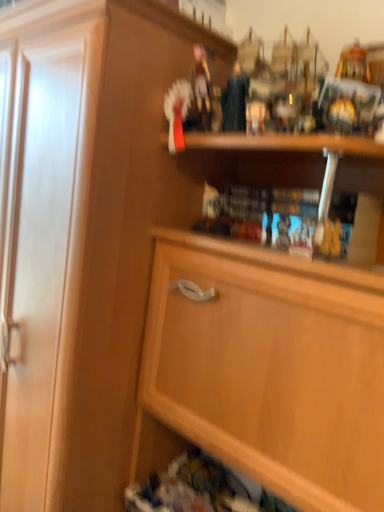
What do you see at coordinates (262, 216) in the screenshot? I see `hardcover book at center` at bounding box center [262, 216].

Locate an element on the screen. hardcover book at center is located at coordinates (262, 216).

Find the location of a particular element. wooden cabinet at upper center is located at coordinates (268, 367).

The image size is (384, 512). What do you see at coordinates (268, 367) in the screenshot? I see `wooden cabinet at upper center` at bounding box center [268, 367].

Identify the location of hardcover book at center. The height and width of the screenshot is (512, 384). (262, 216).

Can you confirm if hardcover book at center is positioned to the left of wooden cabinet at upper center?

Incorrect, hardcover book at center is not on the left side of wooden cabinet at upper center.

Is the depth of hardcover book at center less than that of wooden cabinet at upper center?

No, it is not.

Does point (275, 189) appear closer or farther from the camera than point (371, 499)?

Point (275, 189) is farther from the camera than point (371, 499).

From the image's perspective, is hardcover book at center located above wooden cabinet at upper center?

Yes, from the image's perspective, hardcover book at center is on top of wooden cabinet at upper center.

From a real-world perspective, which is physically above, hardcover book at center or wooden cabinet at upper center?

hardcover book at center.

Which object is thinner, hardcover book at center or wooden cabinet at upper center?

Thinner between the two is hardcover book at center.

Is hardcover book at center taller or shorter than wooden cabinet at upper center?

Clearly, hardcover book at center is shorter compared to wooden cabinet at upper center.

Does hardcover book at center have a smaller size compared to wooden cabinet at upper center?

Yes.

From the picture: Could wooden cabinet at upper center be considered to be inside hardcover book at center?

No, wooden cabinet at upper center is not a part of hardcover book at center.

Is hardcover book at center in contact with wooden cabinet at upper center?

No, hardcover book at center is not next to wooden cabinet at upper center.

Is hardcover book at center oriented away from wooden cabinet at upper center?

Yes, hardcover book at center is positioned with its back facing wooden cabinet at upper center.

Measure the distance between hardcover book at center and wooden cabinet at upper center.

hardcover book at center and wooden cabinet at upper center are 8.58 inches apart from each other.

Find the location of a particular element. The width and height of the screenshot is (384, 512). cabinetry below the hardcover book at center (from the image's perspective) is located at coordinates (268, 367).

Considering the positions of objects wooden cabinet at upper center and hardcover book at center in the image provided, who is more to the left, wooden cabinet at upper center or hardcover book at center?

From the viewer's perspective, wooden cabinet at upper center appears more on the left side.

Is wooden cabinet at upper center closer to camera compared to hardcover book at center?

That is True.

Which is in front, point (197, 254) or point (330, 234)?

The point (330, 234) is in front.

From the image's perspective, is wooden cabinet at upper center below hardcover book at center?

Yes.

From a real-world perspective, which is physically above, wooden cabinet at upper center or hardcover book at center?

From a 3D spatial view, hardcover book at center is above.

Can you confirm if wooden cabinet at upper center is thinner than hardcover book at center?

In fact, wooden cabinet at upper center might be wider than hardcover book at center.

Considering the relative sizes of wooden cabinet at upper center and hardcover book at center in the image provided, is wooden cabinet at upper center taller than hardcover book at center?

Indeed, wooden cabinet at upper center has a greater height compared to hardcover book at center.

Which of these two, wooden cabinet at upper center or hardcover book at center, is smaller?

With smaller size is hardcover book at center.

Is wooden cabinet at upper center not within hardcover book at center?

Yes, wooden cabinet at upper center is located beyond the bounds of hardcover book at center.

Consider the image. Is wooden cabinet at upper center placed right next to hardcover book at center?

No, wooden cabinet at upper center is not beside hardcover book at center.

Is wooden cabinet at upper center positioned with its back to hardcover book at center?

Correct, wooden cabinet at upper center is looking away from hardcover book at center.

How different are the orientations of wooden cabinet at upper center and hardcover book at center in degrees?

The angular difference between wooden cabinet at upper center and hardcover book at center is 1.24 degrees.

How much distance is there between wooden cabinet at upper center and hardcover book at center?

wooden cabinet at upper center is 8.58 inches away from hardcover book at center.

This screenshot has height=512, width=384. In order to click on book above the wooden cabinet at upper center (from a real-world perspective) in this screenshot , I will do `click(262, 216)`.

Where is `book behind the wooden cabinet at upper center`? book behind the wooden cabinet at upper center is located at coordinates (262, 216).

The image size is (384, 512). What are the coordinates of `cabinetry on the left of hardcover book at center` in the screenshot? It's located at (268, 367).